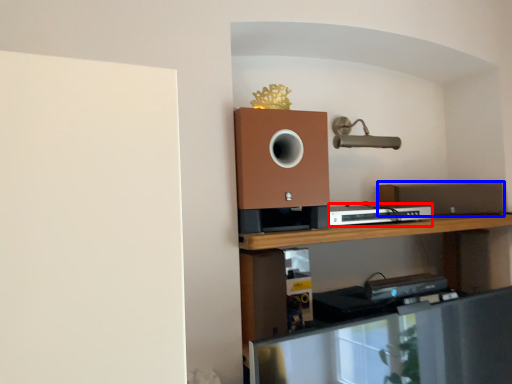
Question: Which object is closer to the camera taking this photo, appliance (highlighted by a red box) or speaker (highlighted by a blue box)?

Choices:
 (A) appliance
 (B) speaker

Answer: (A)